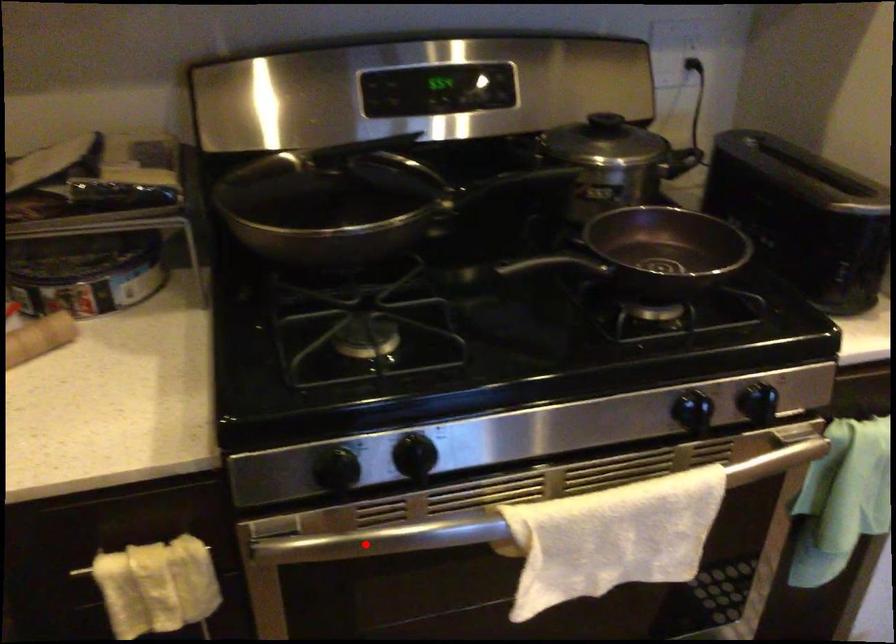
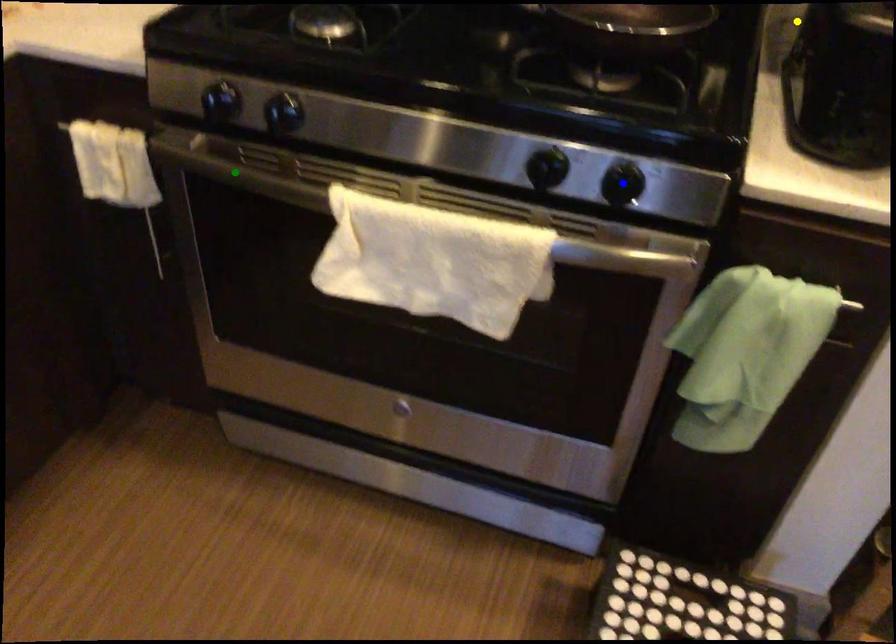
Question: I am providing you with two images of the same scene from different viewpoints. A red point is marked on the first image. You are given multiple points on the second image. Which spot in image 2 lines up with the point in image 1?

Choices:
 (A) blue point
 (B) yellow point
 (C) green point

Answer: (C)